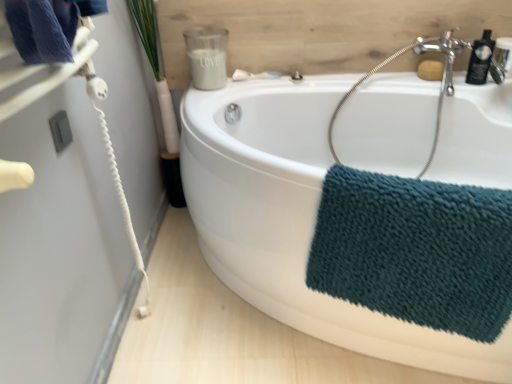
Question: From the image's perspective, is green leafy plant at upper left under white glossy bathtub at center?

Choices:
 (A) yes
 (B) no

Answer: (B)

Question: Is green leafy plant at upper left thinner than white glossy bathtub at center?

Choices:
 (A) yes
 (B) no

Answer: (A)

Question: From a real-world perspective, is green leafy plant at upper left below white glossy bathtub at center?

Choices:
 (A) yes
 (B) no

Answer: (B)

Question: Is green leafy plant at upper left beside white glossy bathtub at center?

Choices:
 (A) no
 (B) yes

Answer: (A)

Question: Is green leafy plant at upper left shorter than white glossy bathtub at center?

Choices:
 (A) no
 (B) yes

Answer: (A)

Question: Is satin nickel faucet at upper right in front of or behind satin nickel faucet at upper right in the image?

Choices:
 (A) behind
 (B) front

Answer: (A)

Question: Is point (506, 59) closer or farther from the camera than point (456, 52)?

Choices:
 (A) farther
 (B) closer

Answer: (B)

Question: Considering the positions of satin nickel faucet at upper right and satin nickel faucet at upper right in the image, is satin nickel faucet at upper right taller or shorter than satin nickel faucet at upper right?

Choices:
 (A) short
 (B) tall

Answer: (A)

Question: Based on their positions, is satin nickel faucet at upper right located to the left or right of satin nickel faucet at upper right?

Choices:
 (A) left
 (B) right

Answer: (B)

Question: Relative to satin nickel faucet at upper right, is green leafy plant at upper left in front or behind?

Choices:
 (A) front
 (B) behind

Answer: (A)

Question: Based on their sizes in the image, would you say green leafy plant at upper left is bigger or smaller than satin nickel faucet at upper right?

Choices:
 (A) small
 (B) big

Answer: (A)

Question: Choose the correct answer: Is green leafy plant at upper left inside satin nickel faucet at upper right or outside it?

Choices:
 (A) inside
 (B) outside

Answer: (B)

Question: In terms of width, does green leafy plant at upper left look wider or thinner when compared to satin nickel faucet at upper right?

Choices:
 (A) wide
 (B) thin

Answer: (A)

Question: Looking at the image, does satin nickel faucet at upper right seem bigger or smaller compared to black glossy bottle at upper right, which appears as the second toiletry when viewed from the left?

Choices:
 (A) small
 (B) big

Answer: (B)

Question: From a real-world perspective, is satin nickel faucet at upper right positioned above or below black glossy bottle at upper right, which appears as the second toiletry when viewed from the left?

Choices:
 (A) above
 (B) below

Answer: (B)